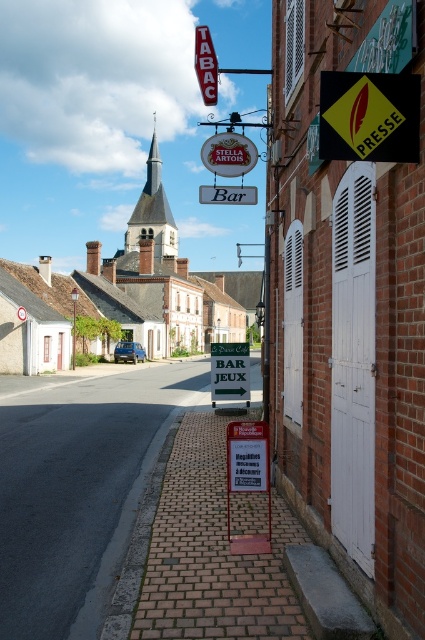
Question: Is yellowmaterial/texturesign at upper right to the right of red neon sign at upper center from the viewer's perspective?

Choices:
 (A) no
 (B) yes

Answer: (B)

Question: Is matte white building at center further to camera compared to yellowmaterial/texturesign at upper right?

Choices:
 (A) yes
 (B) no

Answer: (A)

Question: Which object is positioned farthest from the matte white building at center?

Choices:
 (A) black plastic sign at center
 (B) red neon sign at upper center

Answer: (A)

Question: Which object is positioned farthest from the yellowmaterial/texturesign at upper right?

Choices:
 (A) matte white building at center
 (B) black plastic sign at center
 (C) red neon sign at upper center

Answer: (A)

Question: Is yellowmaterial/texturesign at upper right positioned in front of red neon sign at upper center?

Choices:
 (A) no
 (B) yes

Answer: (B)

Question: Which object is positioned farthest from the black plastic sign at center?

Choices:
 (A) yellowmaterial/texturesign at upper right
 (B) red neon sign at upper center
 (C) matte white building at center

Answer: (C)